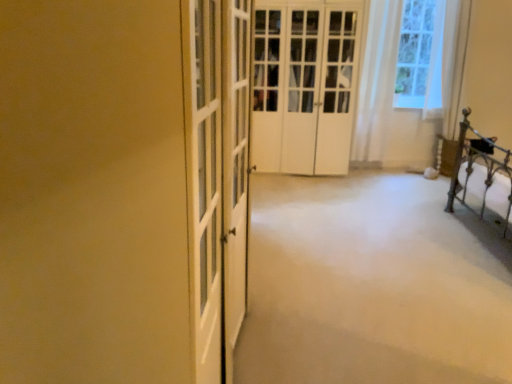
Question: Does white matte door at center have a greater width compared to white sheer curtain at upper right?

Choices:
 (A) yes
 (B) no

Answer: (A)

Question: Does white matte door at center lie in front of white sheer curtain at upper right?

Choices:
 (A) no
 (B) yes

Answer: (B)

Question: Can you confirm if white matte door at center is positioned to the right of white sheer curtain at upper right?

Choices:
 (A) yes
 (B) no

Answer: (B)

Question: Can you confirm if white matte door at center is bigger than white sheer curtain at upper right?

Choices:
 (A) yes
 (B) no

Answer: (A)

Question: From a real-world perspective, is white matte door at center physically above white sheer curtain at upper right?

Choices:
 (A) no
 (B) yes

Answer: (A)

Question: From the image's perspective, is white matte door at center over white sheer curtain at upper right?

Choices:
 (A) no
 (B) yes

Answer: (A)

Question: Is white sheer curtain at upper right not inside white matte door at center?

Choices:
 (A) no
 (B) yes

Answer: (B)

Question: Considering the relative sizes of white sheer curtain at upper right and white matte door at center in the image provided, is white sheer curtain at upper right smaller than white matte door at center?

Choices:
 (A) yes
 (B) no

Answer: (A)

Question: Does white sheer curtain at upper right appear on the left side of white matte door at center?

Choices:
 (A) yes
 (B) no

Answer: (B)

Question: Is white sheer curtain at upper right oriented away from white matte door at center?

Choices:
 (A) no
 (B) yes

Answer: (A)

Question: Considering the relative sizes of white sheer curtain at upper right and white matte door at center in the image provided, is white sheer curtain at upper right taller than white matte door at center?

Choices:
 (A) yes
 (B) no

Answer: (B)

Question: Is white matte door at center surrounded by white sheer curtain at upper right?

Choices:
 (A) no
 (B) yes

Answer: (A)

Question: Does white sheer curtain at upper right have a larger size compared to white carpet at center?

Choices:
 (A) yes
 (B) no

Answer: (B)